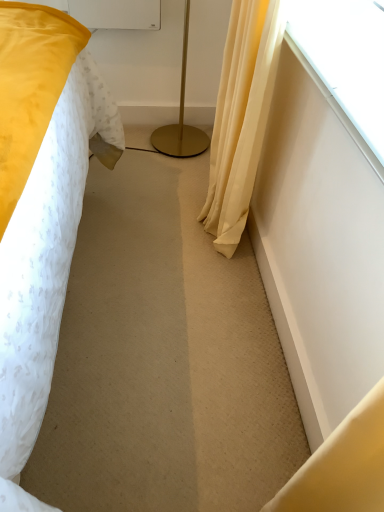
Find the location of a particular element. silky yellow curtain at right is located at coordinates click(241, 116).

Find the location of a particular element. This screenshot has width=384, height=512. gold metallic floor lamp at center is located at coordinates (181, 119).

Locate an element on the screen. The width and height of the screenshot is (384, 512). silky yellow curtain at right is located at coordinates (241, 116).

Is transparent glass window at upper right placed right next to gold metallic floor lamp at center?

No, transparent glass window at upper right is not in contact with gold metallic floor lamp at center.

Is transparent glass window at upper right inside or outside of gold metallic floor lamp at center?

transparent glass window at upper right is located beyond the bounds of gold metallic floor lamp at center.

From the image's perspective, is transparent glass window at upper right under gold metallic floor lamp at center?

Correct, transparent glass window at upper right appears lower than gold metallic floor lamp at center in the image.

You are a GUI agent. You are given a task and a screenshot of the screen. Output one action in this format:
    pyautogui.click(x=<x>, y=<y>)
    Task: Click on the lamp below the silky yellow curtain at right (from a real-world perspective)
    The width and height of the screenshot is (384, 512).
    Given the screenshot: What is the action you would take?
    pyautogui.click(x=181, y=119)

Between silky yellow curtain at right and gold metallic floor lamp at center, which one appears on the right side from the viewer's perspective?

silky yellow curtain at right.

How different are the orientations of silky yellow curtain at right and gold metallic floor lamp at center in degrees?

90 degrees separate the facing orientations of silky yellow curtain at right and gold metallic floor lamp at center.

Choose the correct answer: Is transparent glass window at upper right inside silky yellow curtain at right or outside it?

transparent glass window at upper right cannot be found inside silky yellow curtain at right.

Between transparent glass window at upper right and silky yellow curtain at right, which one appears on the right side from the viewer's perspective?

From the viewer's perspective, transparent glass window at upper right appears more on the right side.

Which is in front, gold metallic floor lamp at center or silky yellow curtain at right?

silky yellow curtain at right is in front.

Is gold metallic floor lamp at center far from silky yellow curtain at right?

No, there isn't a large distance between gold metallic floor lamp at center and silky yellow curtain at right.

Which is more to the right, gold metallic floor lamp at center or silky yellow curtain at right?

Positioned to the right is silky yellow curtain at right.

Does gold metallic floor lamp at center have a lesser height compared to silky yellow curtain at right?

Yes.

Is transparent glass window at upper right at the back of gold metallic floor lamp at center?

No, transparent glass window at upper right is not at the back of gold metallic floor lamp at center.

Is gold metallic floor lamp at center closer to camera compared to transparent glass window at upper right?

No, it is behind transparent glass window at upper right.

Considering the points (191, 128) and (359, 33), which point is behind, point (191, 128) or point (359, 33)?

The point (191, 128) is farther from the camera.

Find the location of `lamp above the transparent glass window at upper right (from the image's perspective)`. lamp above the transparent glass window at upper right (from the image's perspective) is located at coordinates (181, 119).

Which is nearer, (252, 181) or (312, 48)?

The point (312, 48) is in front.

Is silky yellow curtain at right far away from transparent glass window at upper right?

No.

Considering the relative positions of silky yellow curtain at right and transparent glass window at upper right in the image provided, is silky yellow curtain at right to the right of transparent glass window at upper right from the viewer's perspective?

No, silky yellow curtain at right is not to the right of transparent glass window at upper right.

Does silky yellow curtain at right have a lesser height compared to transparent glass window at upper right?

No, silky yellow curtain at right is not shorter than transparent glass window at upper right.

Where is `window above the gold metallic floor lamp at center (from a real-world perspective)`? The height and width of the screenshot is (512, 384). window above the gold metallic floor lamp at center (from a real-world perspective) is located at coordinates tap(346, 58).

Find the location of a particular element. Image resolution: width=384 pixels, height=512 pixels. lamp on the left of the silky yellow curtain at right is located at coordinates (181, 119).

From the image, which object appears to be nearer to transparent glass window at upper right, silky yellow curtain at right or gold metallic floor lamp at center?

silky yellow curtain at right lies closer to transparent glass window at upper right than the other object.

From the image, which object appears to be nearer to silky yellow curtain at right, transparent glass window at upper right or gold metallic floor lamp at center?

transparent glass window at upper right is closer to silky yellow curtain at right.

Looking at this image, looking at the image, which one is located further to transparent glass window at upper right, gold metallic floor lamp at center or silky yellow curtain at right?

gold metallic floor lamp at center is further to transparent glass window at upper right.

Considering their positions, is transparent glass window at upper right positioned further to gold metallic floor lamp at center than silky yellow curtain at right?

transparent glass window at upper right is further to gold metallic floor lamp at center.

Based on their spatial positions, is gold metallic floor lamp at center or transparent glass window at upper right further from silky yellow curtain at right?

gold metallic floor lamp at center is further to silky yellow curtain at right.

Considering their positions, is silky yellow curtain at right positioned closer to gold metallic floor lamp at center than transparent glass window at upper right?

silky yellow curtain at right.

The width and height of the screenshot is (384, 512). I want to click on curtain between transparent glass window at upper right and gold metallic floor lamp at center along the z-axis, so click(x=241, y=116).